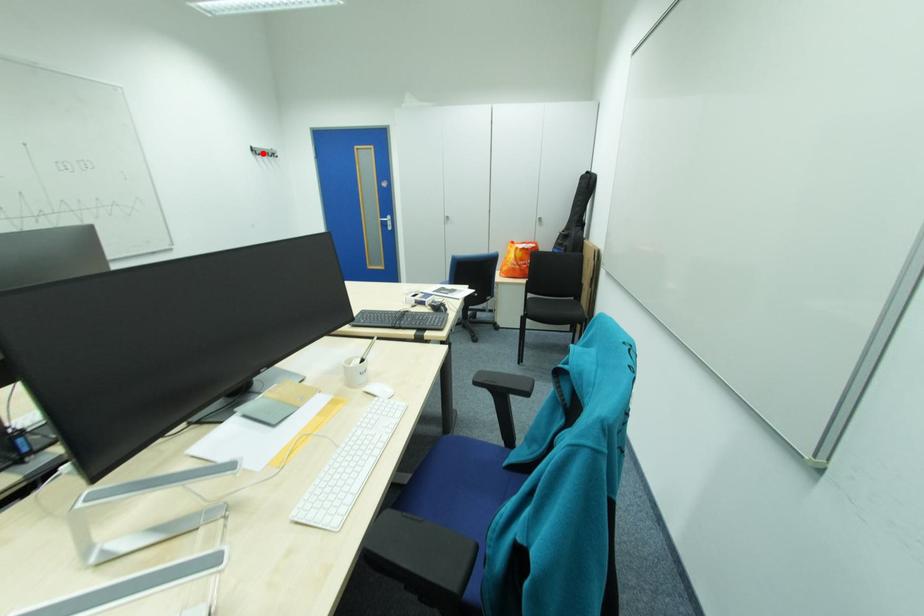
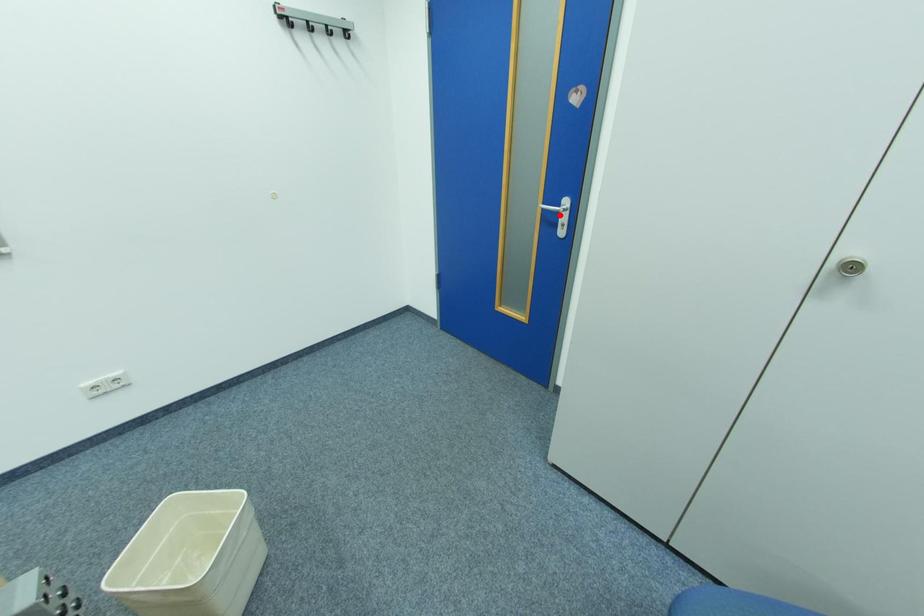
I am providing you with two images of the same scene from different viewpoints. A red point is marked on the first image and another point is marked on the second image. Do the highlighted points in image1 and image2 indicate the same real-world spot?

No